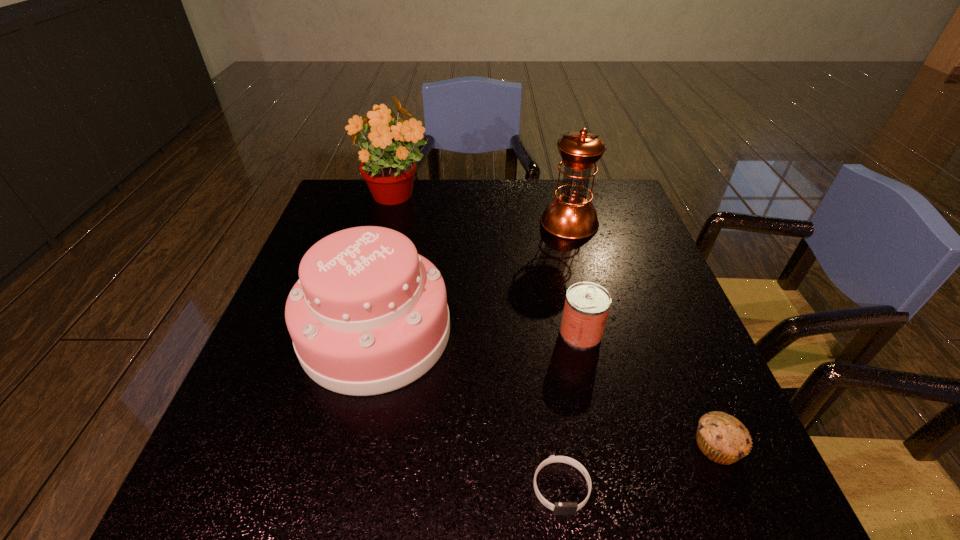
Identify the location of object that is at the far left corner. (389, 168).

You are a GUI agent. You are given a task and a screenshot of the screen. Output one action in this format:
    pyautogui.click(x=<x>, y=<y>)
    Task: Click on the object present at the far right corner
    The image size is (960, 540).
    Given the screenshot: What is the action you would take?
    pyautogui.click(x=571, y=215)

The image size is (960, 540). Identify the location of object positioned at the near right corner. (722, 438).

Identify the location of vacant space at the far edge of the desktop. (448, 201).

Identify the location of vacant point at the near edge. This screenshot has height=540, width=960. (542, 469).

Find the location of a particular element. Image resolution: width=960 pixels, height=540 pixels. free space at the left edge of the desktop is located at coordinates (267, 404).

The image size is (960, 540). Identify the location of free spot at the right edge of the desktop. (657, 394).

In the image, there is a desktop. At what (x,y) coordinates should I click in order to perform the action: click on vacant space at the far left corner. Please return your answer as a coordinate pair (x, y). The width and height of the screenshot is (960, 540). Looking at the image, I should click on (352, 194).

Identify the location of free space at the near left corner. This screenshot has width=960, height=540. (272, 513).

The width and height of the screenshot is (960, 540). Find the location of `free space at the near right corner of the desktop`. free space at the near right corner of the desktop is located at coordinates (757, 484).